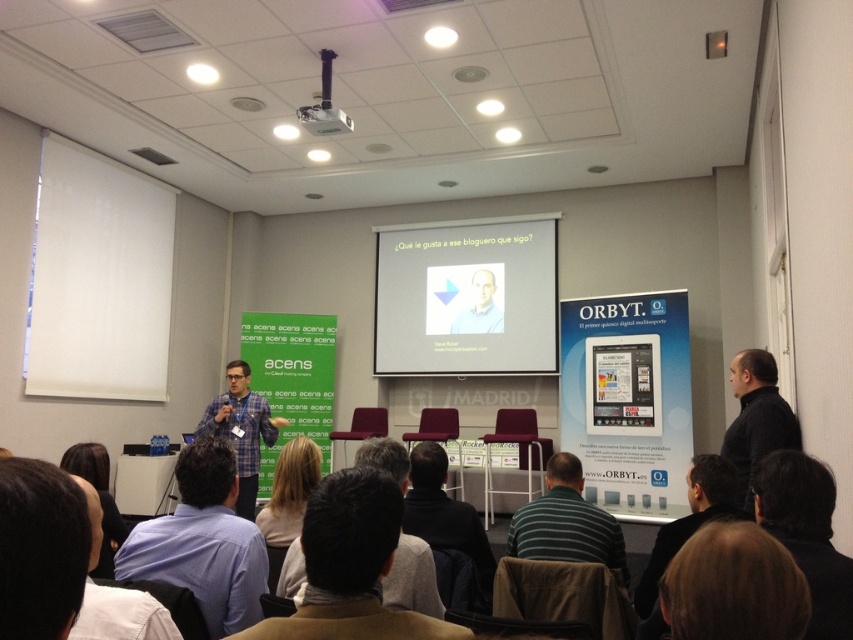
Can you confirm if dark gray jacket at lower center is bigger than plaid shirt at center?

Actually, dark gray jacket at lower center might be smaller than plaid shirt at center.

Who is shorter, dark gray jacket at lower center or plaid shirt at center?

dark gray jacket at lower center is shorter.

At what (x,y) coordinates should I click in order to perform the action: click on dark gray jacket at lower center. Please return your answer as a coordinate pair (x, y). Looking at the image, I should click on (445, 525).

Between dark hair at lower right and black matte jacket at right, which one appears on the right side from the viewer's perspective?

Positioned to the right is black matte jacket at right.

Does point (843, 580) come behind point (737, 442)?

No, it is in front of (737, 442).

Does point (842, 577) come in front of point (744, 394)?

Yes.

Identify the location of dark hair at lower right. The image size is (853, 640). (805, 534).

Which of these two, white matte projector screen at center or black matte jacket at right, stands shorter?

Standing shorter between the two is black matte jacket at right.

Who is more distant from viewer, (x=422, y=301) or (x=763, y=358)?

The point (x=422, y=301) is behind.

Which is behind, point (554, 212) or point (746, 397)?

The point (554, 212) is behind.

This screenshot has height=640, width=853. I want to click on white matte projector screen at center, so pos(466,296).